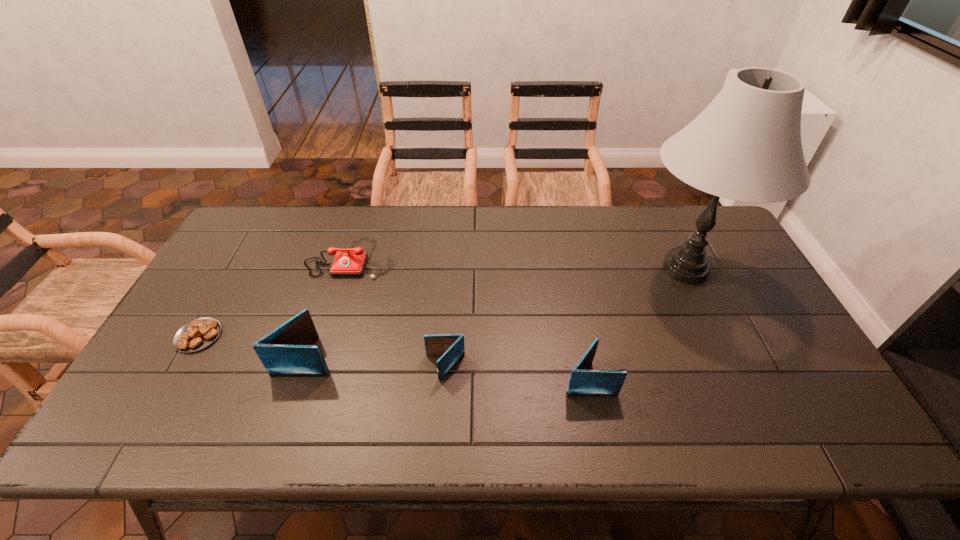
Find the location of a particular element. This screenshot has height=540, width=960. lamp that is at the far edge is located at coordinates (746, 146).

Locate an element on the screen. object that is at the left edge is located at coordinates (199, 333).

This screenshot has width=960, height=540. I want to click on object at the right edge, so click(746, 146).

This screenshot has width=960, height=540. In order to click on object positioned at the far right corner in this screenshot , I will do `click(746, 146)`.

The height and width of the screenshot is (540, 960). In the image, there is a desktop. In order to click on free space at the far edge in this screenshot , I will do `click(547, 217)`.

Locate an element on the screen. This screenshot has width=960, height=540. free region at the near edge is located at coordinates (384, 376).

You are a GUI agent. You are given a task and a screenshot of the screen. Output one action in this format:
    pyautogui.click(x=<x>, y=<y>)
    Task: Click on the blank area at the left edge
    
    Given the screenshot: What is the action you would take?
    pyautogui.click(x=226, y=282)

At what (x,y) coordinates should I click in order to perform the action: click on blank space at the right edge. Please return your answer as a coordinate pair (x, y). Looking at the image, I should click on (802, 367).

Find the location of a particular element. free space at the far left corner of the desktop is located at coordinates (230, 239).

The image size is (960, 540). I want to click on free space at the far right corner of the desktop, so click(680, 227).